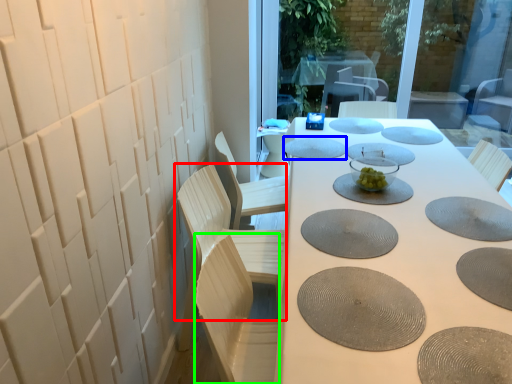
Question: Estimate the real-world distances between objects in this image. Which object is closer to chair (highlighted by a red box), manhole cover (highlighted by a blue box) or swivel chair (highlighted by a green box)?

Choices:
 (A) manhole cover
 (B) swivel chair

Answer: (B)